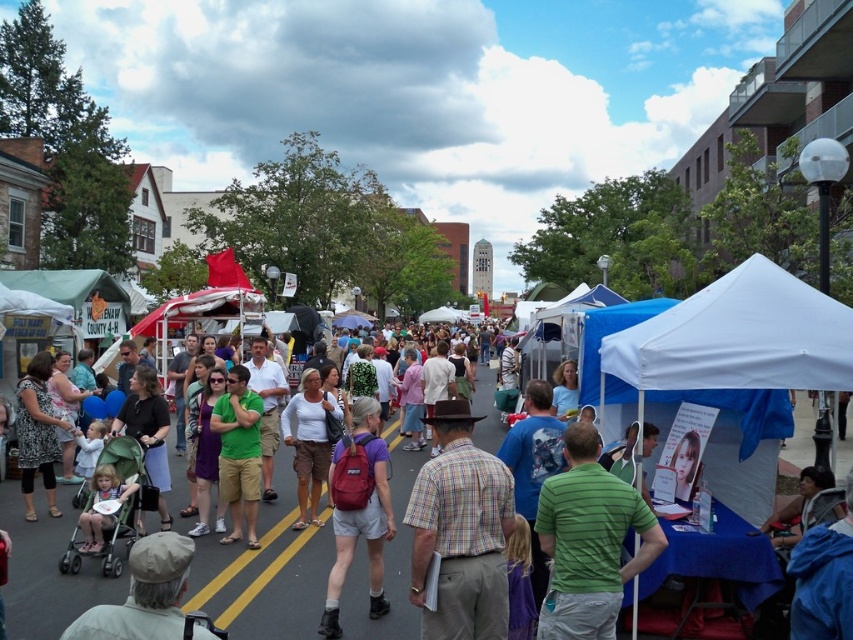
Question: Is plaid cotton shirt at center wider than green striped shirt at center?

Choices:
 (A) no
 (B) yes

Answer: (A)

Question: Which point is farther to the camera?

Choices:
 (A) (679, 557)
 (B) (242, 456)
 (C) (57, 419)

Answer: (C)

Question: Which of the following is the farthest from the observer?

Choices:
 (A) plaid cotton shirt at center
 (B) green cotton shirt at center
 (C) green striped shirt at center

Answer: (B)

Question: Which point appears farthest from the camera in this image?

Choices:
 (A) (573, 634)
 (B) (444, 528)
 (C) (311, 504)
 (D) (227, 467)

Answer: (C)

Question: From the image, what is the correct spatial relationship of matte red backpack at center in relation to green cotton shirt at center?

Choices:
 (A) above
 (B) below

Answer: (B)

Question: Does matte red backpack at center lie behind matte white shirt at center?

Choices:
 (A) no
 (B) yes

Answer: (A)